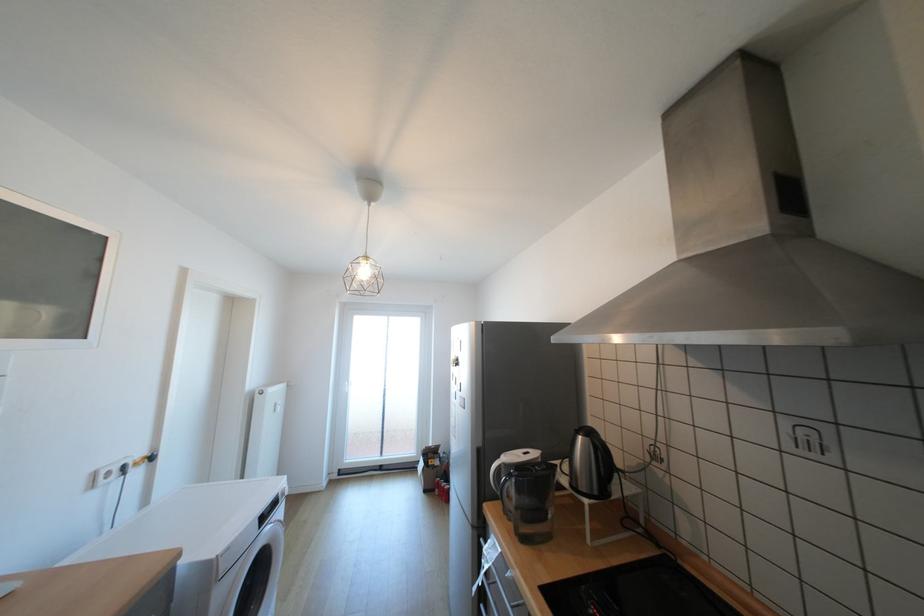
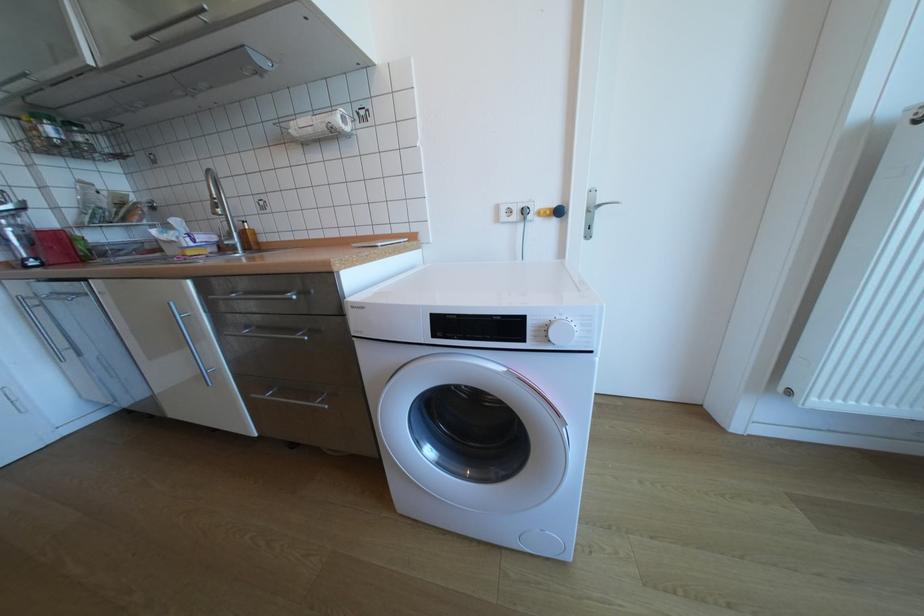
Find the pixel in the second image that matches point 118,472 in the first image.

(518, 211)